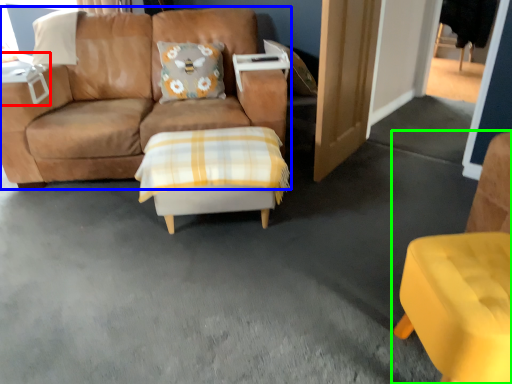
Question: Which is farther away from table (highlighted by a red box)? studio couch (highlighted by a blue box) or chair (highlighted by a green box)?

Choices:
 (A) studio couch
 (B) chair

Answer: (B)